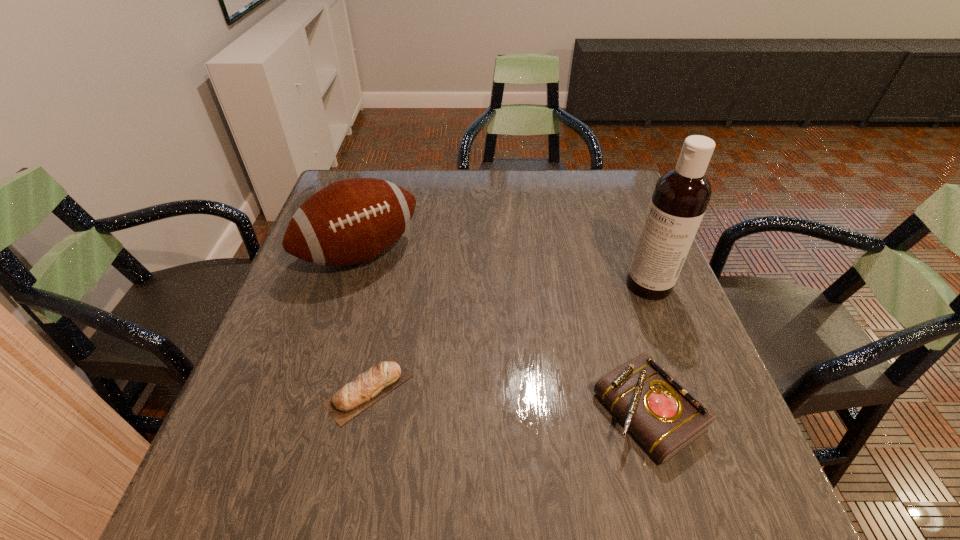
In the image, there is a desktop. Identify the location of free space at the far edge. (473, 174).

Image resolution: width=960 pixels, height=540 pixels. In the image, there is a desktop. Find the location of `vacant space at the near edge`. vacant space at the near edge is located at coordinates (418, 420).

Locate an element on the screen. This screenshot has width=960, height=540. free location at the left edge is located at coordinates (350, 279).

The width and height of the screenshot is (960, 540). Find the location of `vacant space at the right edge of the desktop`. vacant space at the right edge of the desktop is located at coordinates (597, 252).

The width and height of the screenshot is (960, 540). What are the coordinates of `blank space at the near left corner of the desktop` in the screenshot? It's located at (254, 416).

Where is `vacant space in between the dishwasher detergent and the football`? vacant space in between the dishwasher detergent and the football is located at coordinates (505, 269).

Identify the location of vacant space that is in between the dishwasher detergent and the third shortest object. The image size is (960, 540). (505, 269).

Find the location of a particular element. vacant point located between the third tallest object and the dishwasher detergent is located at coordinates (648, 348).

At what (x,y) coordinates should I click in order to perform the action: click on free spot between the pita bread and the second tallest object. Please return your answer as a coordinate pair (x, y). Looking at the image, I should click on (365, 321).

The width and height of the screenshot is (960, 540). Identify the location of vacant space in between the second tallest object and the third tallest object. (504, 333).